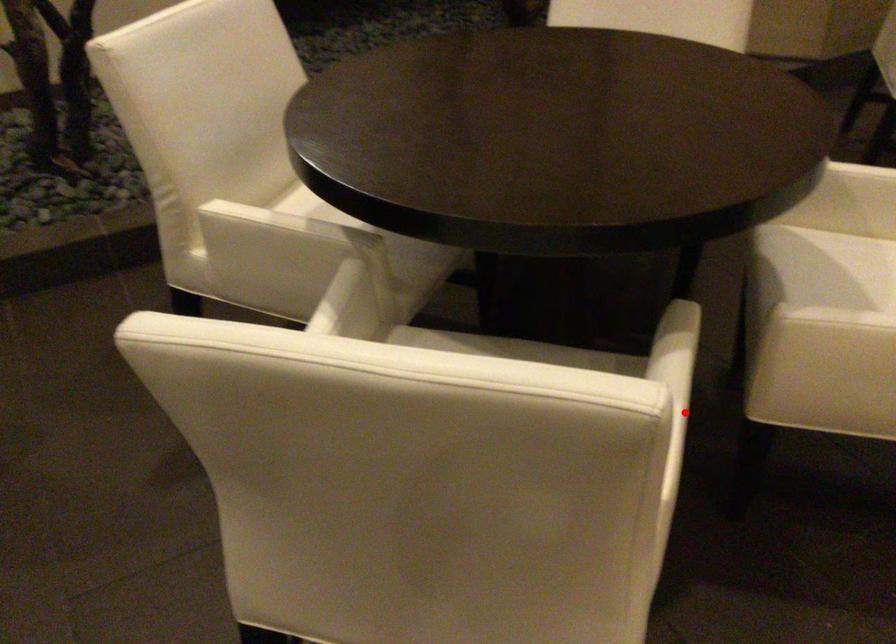
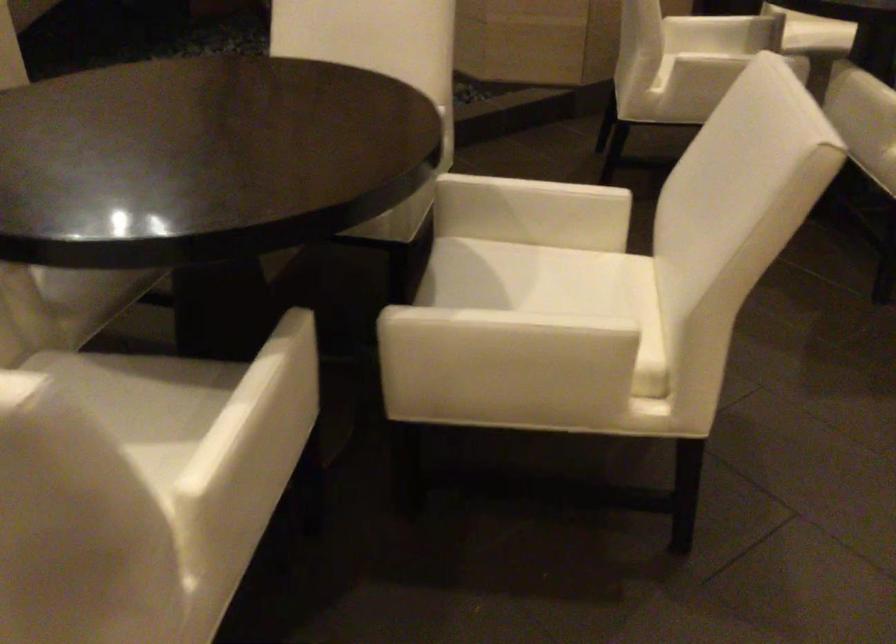
In the second image, find the point that corresponds to the highlighted location in the first image.

(299, 413)